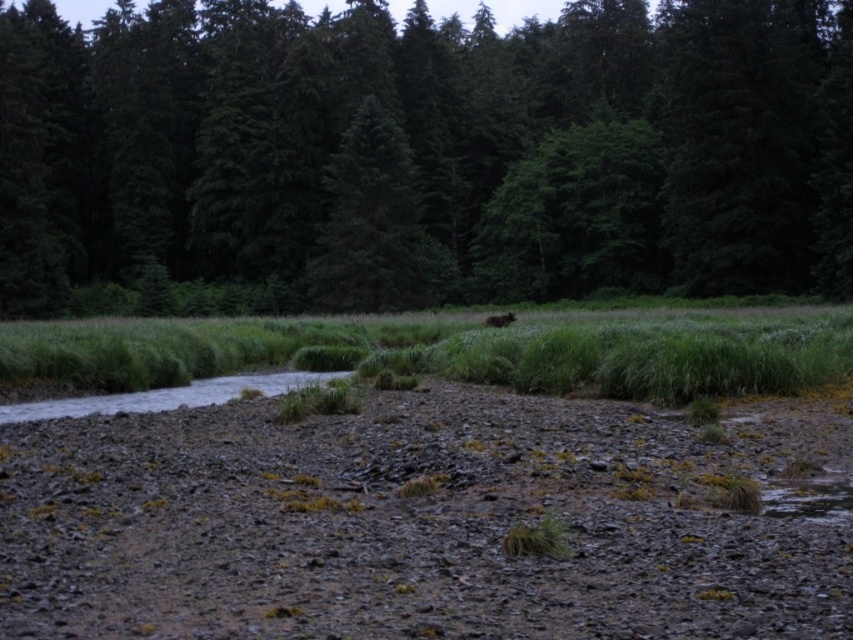
Question: Does green grass at center have a lesser width compared to brown furry bear at center?

Choices:
 (A) yes
 (B) no

Answer: (B)

Question: Which point appears closest to the camera in this image?

Choices:
 (A) (250, 323)
 (B) (178, 202)
 (C) (512, 317)

Answer: (C)

Question: Among these points, which one is nearest to the camera?

Choices:
 (A) (666, 253)
 (B) (570, 314)
 (C) (373, 200)

Answer: (B)

Question: Which is farther from the green matte tree at upper center?

Choices:
 (A) brown furry bear at center
 (B) green grass at center
 (C) green matte tree at center

Answer: (A)

Question: Is green matte tree at upper center in front of green grass at center?

Choices:
 (A) no
 (B) yes

Answer: (A)

Question: Is green matte tree at upper center to the left of green grass at center from the viewer's perspective?

Choices:
 (A) yes
 (B) no

Answer: (A)